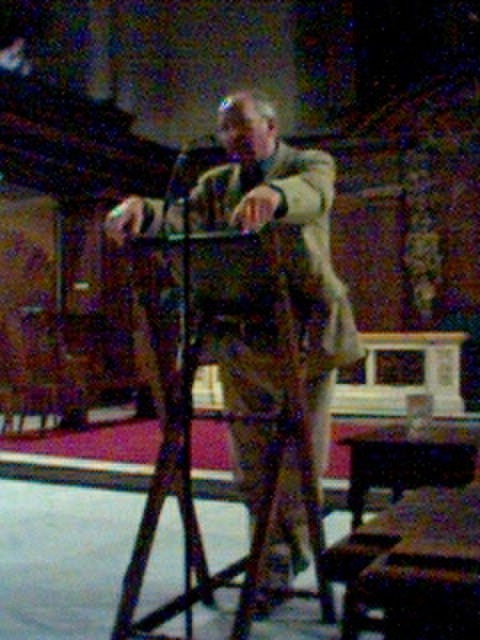
Question: Among these points, which one is farthest from the camera?

Choices:
 (A) (312, 477)
 (B) (186, 145)

Answer: (B)

Question: Which point appears farthest from the camera in this image?

Choices:
 (A) (197, 344)
 (B) (205, 145)

Answer: (B)

Question: Is black matte tripod at center below matte black microphone at center?

Choices:
 (A) no
 (B) yes

Answer: (B)

Question: In this image, where is black matte tripod at center located relative to matte black microphone at center?

Choices:
 (A) above
 (B) below

Answer: (B)

Question: Which point is closer to the camera?

Choices:
 (A) black matte tripod at center
 (B) matte black microphone at center

Answer: (A)

Question: Observing the image, what is the correct spatial positioning of black matte tripod at center in reference to matte black microphone at center?

Choices:
 (A) right
 (B) left

Answer: (A)